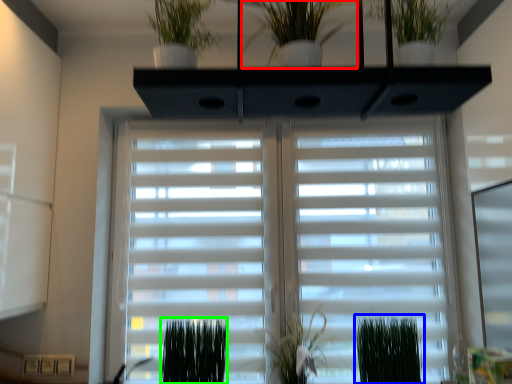
Question: Considering the real-world distances, which object is closest to houseplant (highlighted by a red box)? plant (highlighted by a blue box) or plant (highlighted by a green box).

Choices:
 (A) plant
 (B) plant

Answer: (B)